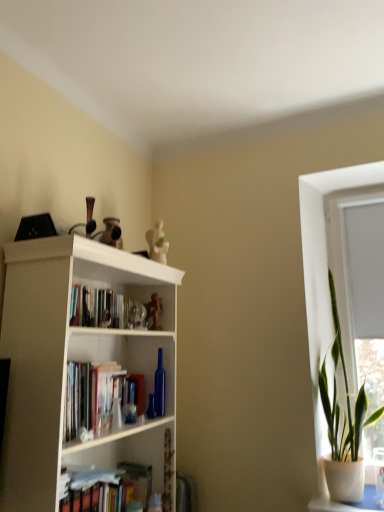
What do you see at coordinates (75, 360) in the screenshot?
I see `white matte bookcase at upper left` at bounding box center [75, 360].

Measure the distance between green leafy plant in pot at right and camera.

A distance of 2.12 meters exists between green leafy plant in pot at right and camera.

Where is `white plastic window frame at upper right`? This screenshot has width=384, height=512. white plastic window frame at upper right is located at coordinates (361, 286).

At what (x,y) coordinates should I click in order to perform the action: click on hardcover books at center. Please return your answer as a coordinate pair (x, y). This screenshot has width=384, height=512. Looking at the image, I should click on (111, 309).

Find the location of `white matte bookcase at upper left`. white matte bookcase at upper left is located at coordinates pos(75,360).

Who is smaller, white matte bookcase at upper left or white plastic window frame at upper right?

white plastic window frame at upper right.

From a real-world perspective, is white matte bookcase at upper left above or below white plastic window frame at upper right?

Clearly, from a real-world perspective, white matte bookcase at upper left is below white plastic window frame at upper right.

Between white matte bookcase at upper left and white plastic window frame at upper right, which one has less height?

white plastic window frame at upper right is shorter.

What's the angular difference between white matte bookcase at upper left and white plastic window frame at upper right's facing directions?

There is a 90-degree angle between the facing directions of white matte bookcase at upper left and white plastic window frame at upper right.

Is hardcover books at center facing away from white matte bookcase at upper left?

Yes, hardcover books at center is facing away from white matte bookcase at upper left.

Considering the relative sizes of hardcover books at center and white matte bookcase at upper left in the image provided, is hardcover books at center thinner than white matte bookcase at upper left?

Yes, hardcover books at center is thinner than white matte bookcase at upper left.

From a real-world perspective, between hardcover books at center and white matte bookcase at upper left, who is vertically lower?

white matte bookcase at upper left is physically lower.

Visually, is hardcover books at center positioned to the left or to the right of white matte bookcase at upper left?

hardcover books at center is to the left of white matte bookcase at upper left.

Which object is wider, white matte bookcase at upper left or green leafy plant in pot at right?

white matte bookcase at upper left is wider.

Is white matte bookcase at upper left not within green leafy plant in pot at right?

Indeed, white matte bookcase at upper left is completely outside green leafy plant in pot at right.

You are a GUI agent. You are given a task and a screenshot of the screen. Output one action in this format:
    pyautogui.click(x=<x>, y=<y>)
    Task: Click on the bookcase lying below the green leafy plant in pot at right (from the image's perspective)
    The width and height of the screenshot is (384, 512).
    Given the screenshot: What is the action you would take?
    pyautogui.click(x=75, y=360)

Relative to green leafy plant in pot at right, is white matte bookcase at upper left in front or behind?

In the image, white matte bookcase at upper left appears in front of green leafy plant in pot at right.

Is green leafy plant in pot at right aimed at hardcover books at center?

No.

Considering the positions of point (328, 479) and point (87, 298), is point (328, 479) closer or farther from the camera than point (87, 298)?

Point (328, 479) is farther from the camera than point (87, 298).

From their relative heights in the image, would you say green leafy plant in pot at right is taller or shorter than hardcover books at center?

green leafy plant in pot at right is taller than hardcover books at center.

Is white plastic window frame at upper right placed right next to green leafy plant in pot at right?

No, white plastic window frame at upper right is not in contact with green leafy plant in pot at right.

Between white plastic window frame at upper right and green leafy plant in pot at right, which one has larger width?

green leafy plant in pot at right.

Considering the relative positions of white plastic window frame at upper right and green leafy plant in pot at right in the image provided, is white plastic window frame at upper right to the left or to the right of green leafy plant in pot at right?

Clearly, white plastic window frame at upper right is on the right of green leafy plant in pot at right in the image.

From the image's perspective, is hardcover books at center above white plastic window frame at upper right?

No, from the image's perspective, hardcover books at center is not on top of white plastic window frame at upper right.

From a real-world perspective, who is located higher, hardcover books at center or white plastic window frame at upper right?

white plastic window frame at upper right, from a real-world perspective.

How much distance is there between hardcover books at center and white plastic window frame at upper right?

hardcover books at center and white plastic window frame at upper right are 4.26 feet apart.

Where is `book on the left of white plastic window frame at upper right`? The width and height of the screenshot is (384, 512). book on the left of white plastic window frame at upper right is located at coordinates (111, 309).

Are hardcover books at center and green leafy plant in pot at right beside each other?

No, hardcover books at center is not beside green leafy plant in pot at right.

Does hardcover books at center have a smaller size compared to green leafy plant in pot at right?

Yes, hardcover books at center is smaller than green leafy plant in pot at right.

Looking at their sizes, would you say hardcover books at center is wider or thinner than green leafy plant in pot at right?

Considering their sizes, hardcover books at center looks slimmer than green leafy plant in pot at right.

Locate an element on the screen. This screenshot has width=384, height=512. bookcase that is in front of the white plastic window frame at upper right is located at coordinates (75, 360).

This screenshot has height=512, width=384. Find the location of `book behind the white matte bookcase at upper left`. book behind the white matte bookcase at upper left is located at coordinates (111, 309).

Which object lies nearer to the anchor point white matte bookcase at upper left, white plastic window frame at upper right or hardcover books at center?

hardcover books at center is positioned closer to the anchor white matte bookcase at upper left.

Which object lies further to the anchor point white plastic window frame at upper right, green leafy plant in pot at right or white matte bookcase at upper left?

The object further to white plastic window frame at upper right is white matte bookcase at upper left.

Looking at the image, which one is located further to hardcover books at center, green leafy plant in pot at right or white plastic window frame at upper right?

white plastic window frame at upper right.

Considering their positions, is white matte bookcase at upper left positioned further to white plastic window frame at upper right than green leafy plant in pot at right?

white matte bookcase at upper left is positioned further to the anchor white plastic window frame at upper right.

Looking at the image, which one is located closer to hardcover books at center, white plastic window frame at upper right or white matte bookcase at upper left?

white matte bookcase at upper left is closer to hardcover books at center.

Consider the image. Estimate the real-world distances between objects in this image. Which object is closer to white matte bookcase at upper left, green leafy plant in pot at right or white plastic window frame at upper right?

The object closer to white matte bookcase at upper left is green leafy plant in pot at right.

Considering their positions, is hardcover books at center positioned further to white plastic window frame at upper right than green leafy plant in pot at right?

Among the two, hardcover books at center is located further to white plastic window frame at upper right.

Which object lies further to the anchor point green leafy plant in pot at right, white matte bookcase at upper left or hardcover books at center?

hardcover books at center is positioned further to the anchor green leafy plant in pot at right.

You are a GUI agent. You are given a task and a screenshot of the screen. Output one action in this format:
    pyautogui.click(x=<x>, y=<y>)
    Task: Click on the houseplant situated between white matte bookcase at upper left and white plastic window frame at upper right from left to right
    The image size is (384, 512).
    Given the screenshot: What is the action you would take?
    pyautogui.click(x=343, y=423)

The width and height of the screenshot is (384, 512). Identify the location of bookcase between hardcover books at center and green leafy plant in pot at right from left to right. (75, 360).

Image resolution: width=384 pixels, height=512 pixels. Find the location of `houseplant between hardcover books at center and white plastic window frame at upper right in the horizontal direction`. houseplant between hardcover books at center and white plastic window frame at upper right in the horizontal direction is located at coordinates (343, 423).

The image size is (384, 512). What are the coordinates of `bookcase between hardcover books at center and white plastic window frame at upper right in the horizontal direction` in the screenshot? It's located at (75, 360).